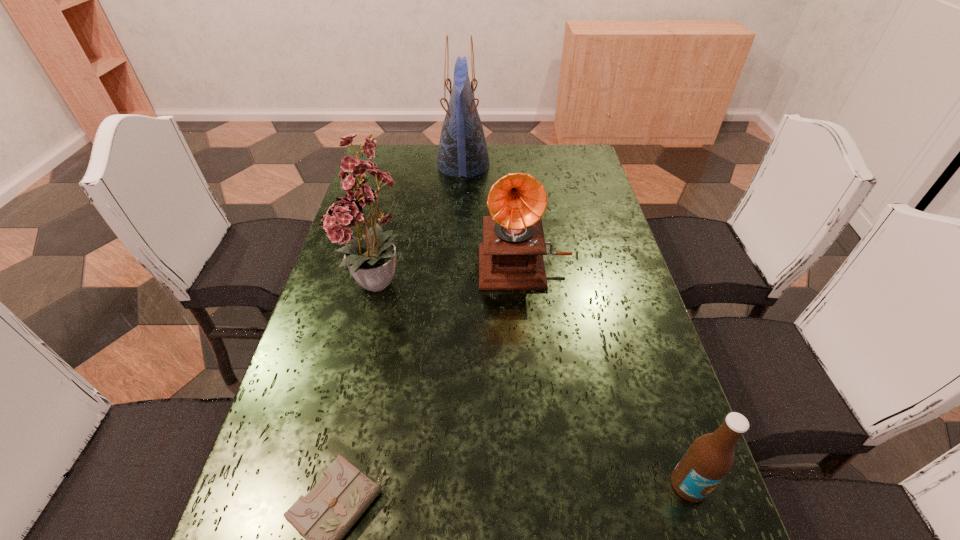
The image size is (960, 540). What are the coordinates of `the farthest object` in the screenshot? It's located at (462, 151).

Where is `flower arrangement`? The image size is (960, 540). flower arrangement is located at coordinates (372, 260).

Where is `the third tallest object`? This screenshot has width=960, height=540. the third tallest object is located at coordinates (511, 256).

Identify the location of the rightmost object. Image resolution: width=960 pixels, height=540 pixels. (710, 457).

Image resolution: width=960 pixels, height=540 pixels. Find the location of `the fourth tallest object`. the fourth tallest object is located at coordinates (710, 457).

The width and height of the screenshot is (960, 540). In order to click on free space located on the front of the shopping bag in this screenshot , I will do `click(459, 258)`.

You are a GUI agent. You are given a task and a screenshot of the screen. Output one action in this format:
    pyautogui.click(x=<x>, y=<y>)
    Task: Click on the free space located on the front-facing side of the flower arrangement
    This screenshot has height=540, width=960.
    Given the screenshot: What is the action you would take?
    [342, 449]

Locate an element on the screen. This screenshot has width=960, height=540. free spot located on the horn of the third tallest object is located at coordinates (528, 307).

Image resolution: width=960 pixels, height=540 pixels. I want to click on vacant space situated on the left of the rightmost object, so click(633, 484).

Where is `object that is at the far edge`? object that is at the far edge is located at coordinates (462, 151).